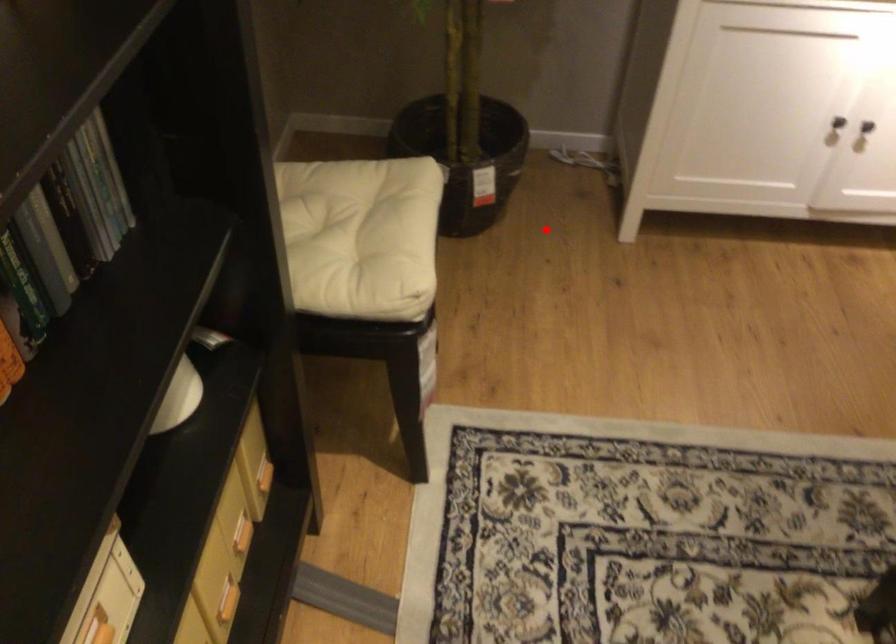
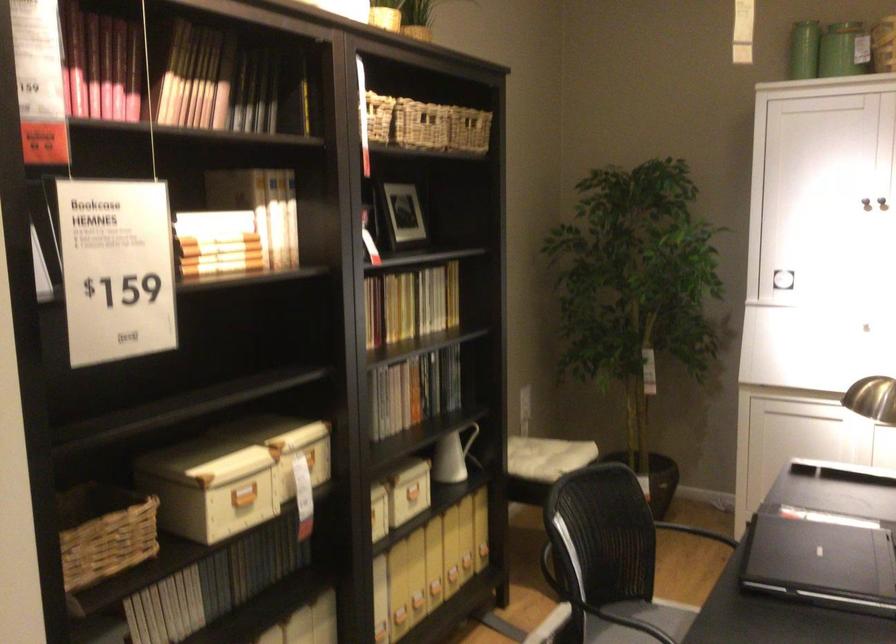
Question: I am providing you with two images of the same scene from different viewpoints. Given a red point in image1, look at the same physical point in image2. Is it:

Choices:
 (A) Closer to the viewpoint
 (B) Farther from the viewpoint

Answer: (B)